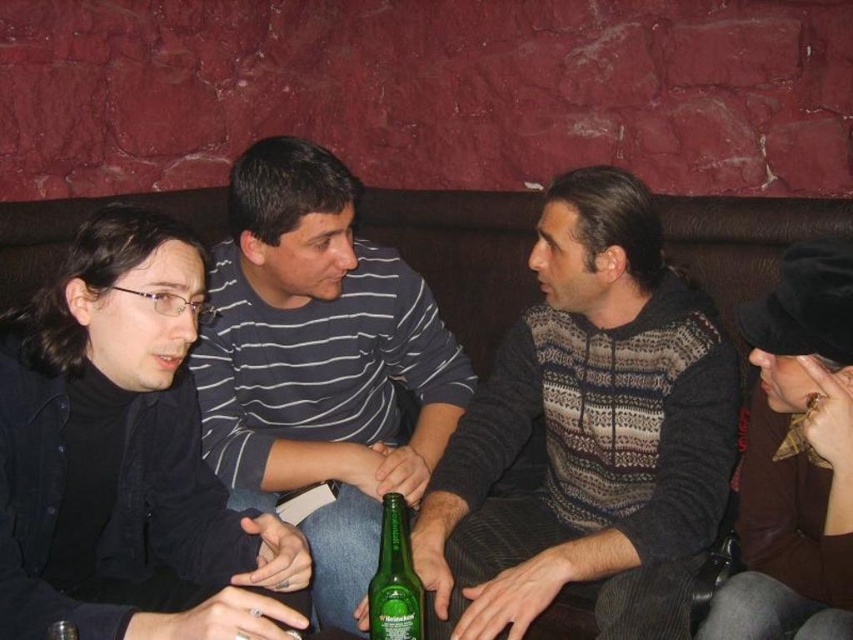
You are a fashion designer analyzing the image. You need to determine the exact location of the knitted sweater at center in the scene. Based on the coordinate system where the bottom left corner is the origin, can you specify its coordinates?

The knitted sweater at center is located at coordinates point (x=589, y=435).

You are a bartender who needs to place a green glass bottle at center on the table between the striped cotton shirt at center and another object. Can you fit it there based on their heights?

The striped cotton shirt at center has a greater height compared to the green glass bottle at center. Since the bottle is shorter, it should fit on the table between them without issue.